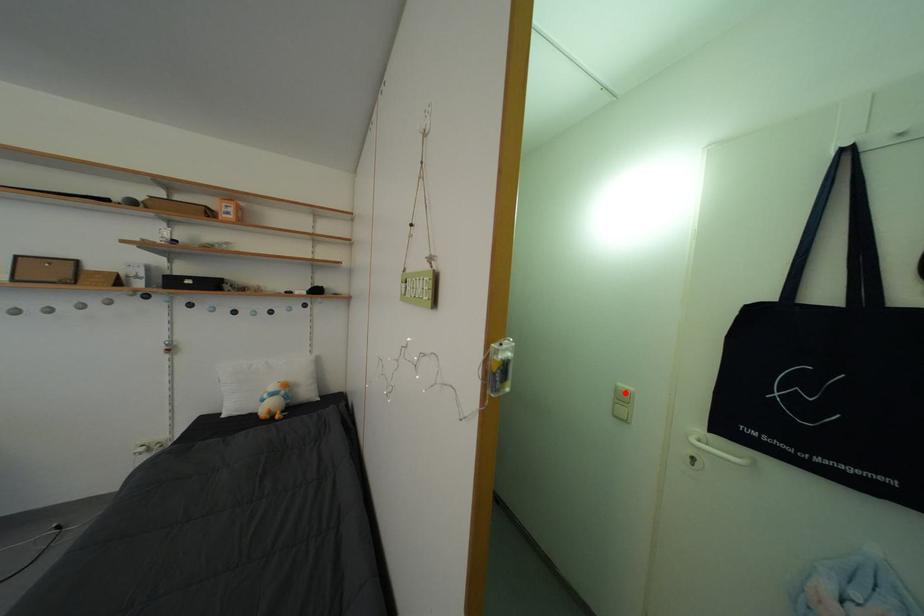
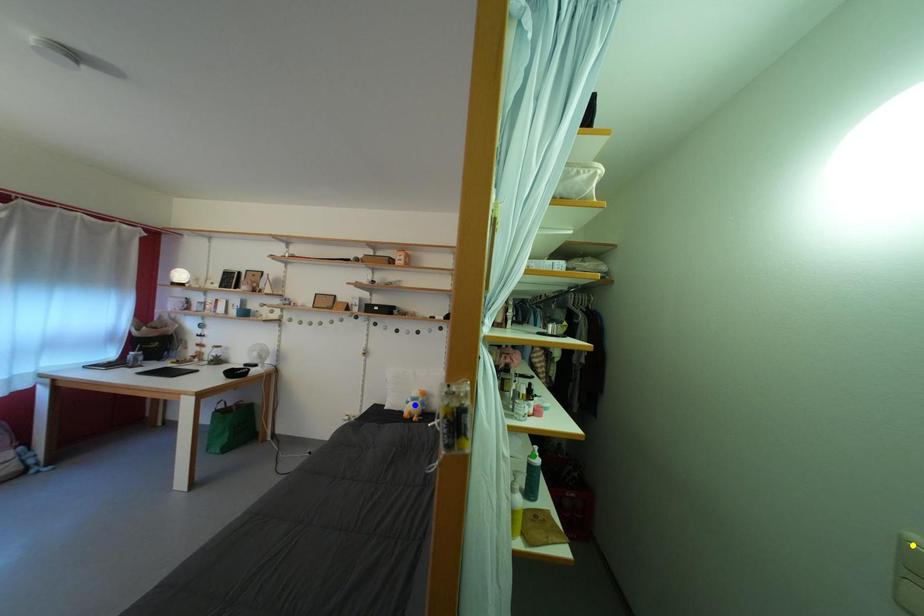
Question: I am providing you with two images of the same scene from different viewpoints. A red point is marked on the first image. You are given multiple points on the second image. Which point in image 2 represents the same 3d spot as the red point in image 1?

Choices:
 (A) blue point
 (B) green point
 (C) yellow point

Answer: (C)